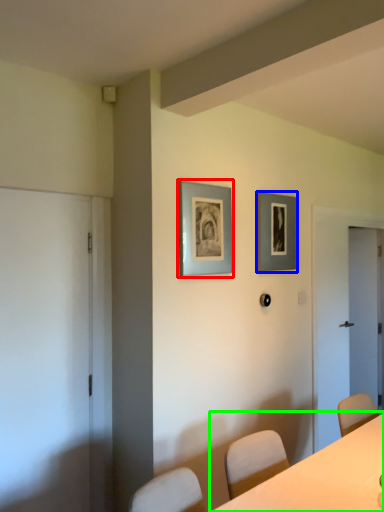
Question: Which object is the farthest from picture frame (highlighted by a red box)? Choose among these: picture frame (highlighted by a blue box) or table (highlighted by a green box).

Choices:
 (A) picture frame
 (B) table

Answer: (B)